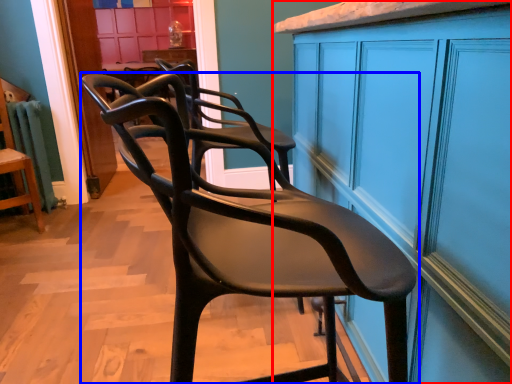
Question: Among these objects, which one is farthest to the camera, cabinetry (highlighted by a red box) or chair (highlighted by a blue box)?

Choices:
 (A) cabinetry
 (B) chair

Answer: (B)